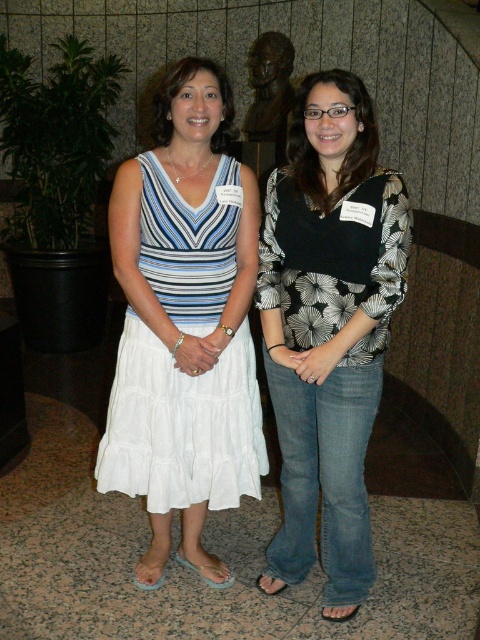
You are organizing a charity event and need to place a small donation box between the white cotton dress at center and the bronze statue at center. The donation box requires a minimum space of 1 meter. Can you fit it between them?

The white cotton dress at center is bigger than the bronze statue at center, but the description does not provide the distance between them. Therefore, it is impossible to determine if the donation box can fit between them.

You are standing in a room where two women are present. You need to place a small decoration exactly at the point marked as point (x=324, y=509). Considering the women are standing at their respective positions, will the decoration be closer to the woman on the left or the woman on the right?

The distance of point (x=324, y=509) from camera is 6.59 feet. Since the exact positions of the women relative to this point aren not provided, it is impossible to determine which woman the decoration would be closer to based on the given information.